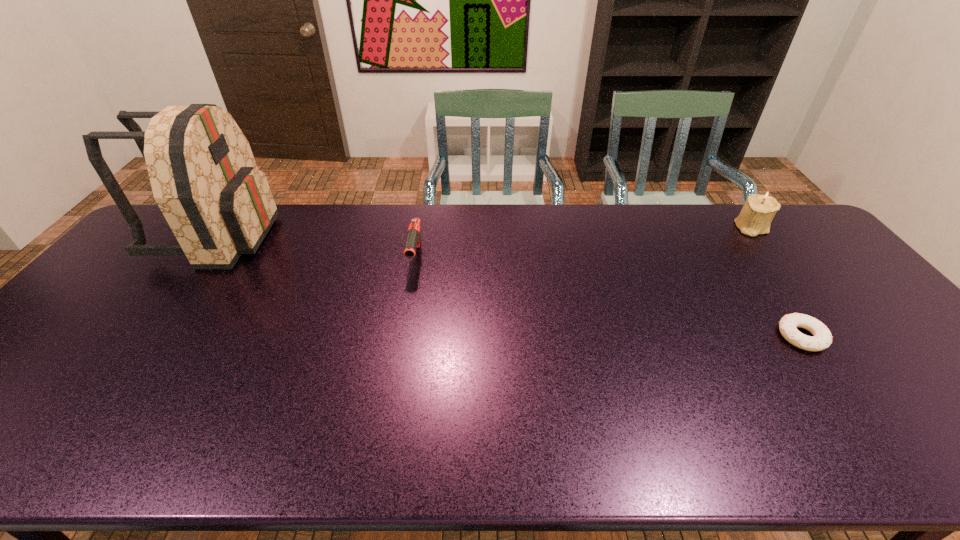
This screenshot has height=540, width=960. I want to click on backpack, so click(204, 178).

You are a GUI agent. You are given a task and a screenshot of the screen. Output one action in this format:
    pyautogui.click(x=<x>, y=<y>)
    Task: Click on the tallest object
    The width and height of the screenshot is (960, 540).
    Given the screenshot: What is the action you would take?
    pyautogui.click(x=204, y=178)

Locate an element on the screen. This screenshot has height=540, width=960. the third shortest object is located at coordinates (755, 218).

The width and height of the screenshot is (960, 540). Identify the location of the third tallest object. (413, 241).

You are a GUI agent. You are given a task and a screenshot of the screen. Output one action in this format:
    pyautogui.click(x=<x>, y=<y>)
    Task: Click on the gun
    This screenshot has height=540, width=960.
    Given the screenshot: What is the action you would take?
    pyautogui.click(x=413, y=241)

Find the location of `the nearest object`. the nearest object is located at coordinates (822, 338).

I want to click on doughnut, so click(822, 338).

Identify the location of vacant space positioned on the front face of the backpack. The image size is (960, 540). (352, 235).

Find the location of a particular element. The height and width of the screenshot is (540, 960). vacant region located on the front of the candle_holder is located at coordinates (780, 264).

The width and height of the screenshot is (960, 540). Find the location of `vacant space positioned 0.060m at the aiming end of the second object from left to right`. vacant space positioned 0.060m at the aiming end of the second object from left to right is located at coordinates (410, 292).